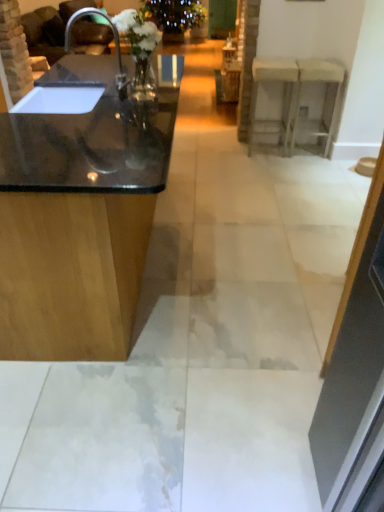
Question: From a real-world perspective, does black glossy countertop at left, the 2th counter viewed from the back, stand above white glossy counter at upper right, the 2th counter when ordered from front to back?

Choices:
 (A) no
 (B) yes

Answer: (B)

Question: Can you confirm if black glossy countertop at left, arranged as the 1th counter when viewed from the left, is smaller than white glossy counter at upper right, the 1th counter viewed from the right?

Choices:
 (A) no
 (B) yes

Answer: (A)

Question: Is black glossy countertop at left, the 2th counter viewed from the back, oriented away from white glossy counter at upper right, the 2th counter when ordered from front to back?

Choices:
 (A) yes
 (B) no

Answer: (B)

Question: Is black glossy countertop at left, the first counter viewed from the front, outside of white glossy counter at upper right, the 1th counter in the back-to-front sequence?

Choices:
 (A) yes
 (B) no

Answer: (A)

Question: From the image's perspective, is black glossy countertop at left, the 2th counter viewed from the back, over white glossy counter at upper right, the 2th counter when ordered from front to back?

Choices:
 (A) yes
 (B) no

Answer: (B)

Question: Is black glossy countertop at left, the second counter in the right-to-left sequence, behind white glossy counter at upper right, the 2th counter when ordered from front to back?

Choices:
 (A) no
 (B) yes

Answer: (A)

Question: Is white glossy counter at upper right, the 1th counter viewed from the right, with black glossy countertop at left, the second counter in the right-to-left sequence?

Choices:
 (A) no
 (B) yes

Answer: (A)

Question: Would you say white glossy counter at upper right, the 2th counter when ordered from front to back, contains black glossy countertop at left, arranged as the 1th counter when viewed from the left?

Choices:
 (A) yes
 (B) no

Answer: (B)

Question: Considering the relative sizes of white glossy counter at upper right, which is the 2th counter from left to right, and black glossy countertop at left, the second counter in the right-to-left sequence, in the image provided, is white glossy counter at upper right, which is the 2th counter from left to right, thinner than black glossy countertop at left, the second counter in the right-to-left sequence,?

Choices:
 (A) no
 (B) yes

Answer: (B)

Question: From the image's perspective, would you say white glossy counter at upper right, which is the 2th counter from left to right, is positioned over black glossy countertop at left, the first counter viewed from the front?

Choices:
 (A) no
 (B) yes

Answer: (B)

Question: From the image's perspective, is white glossy counter at upper right, the 2th counter when ordered from front to back, under black glossy countertop at left, the second counter in the right-to-left sequence?

Choices:
 (A) yes
 (B) no

Answer: (B)

Question: Is white glossy counter at upper right, which is the 2th counter from left to right, in front of transparent glass door at upper center?

Choices:
 (A) yes
 (B) no

Answer: (A)